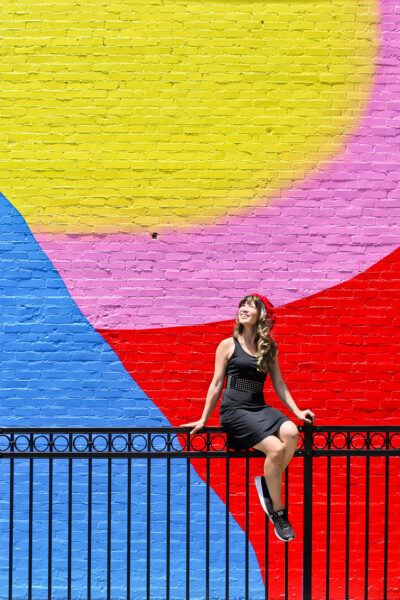
In order to click on top rail in this screenshot , I will do `click(169, 429)`.